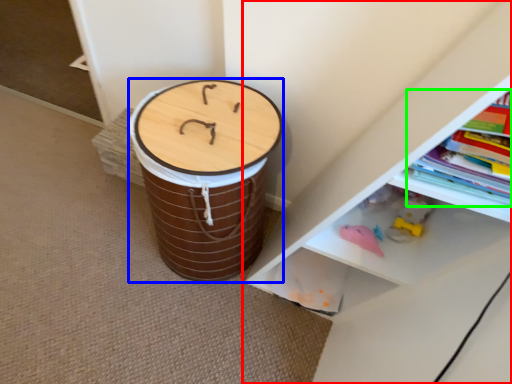
Question: Which is farther away from shelf (highlighted by a red box)? drum (highlighted by a blue box) or book (highlighted by a green box)?

Choices:
 (A) drum
 (B) book

Answer: (A)